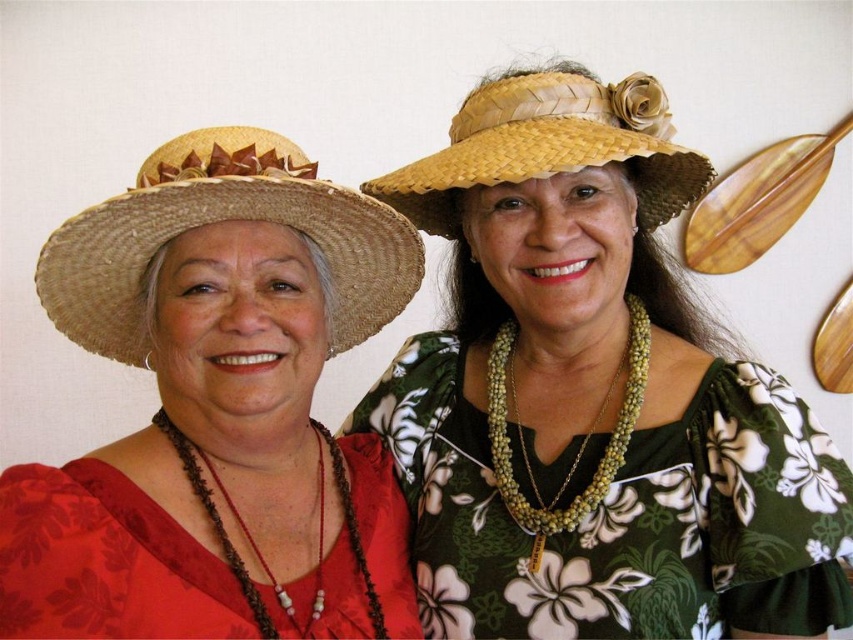
Does matte straw hat at upper center have a lesser height compared to woven straw hat at upper center?

No.

Can you confirm if matte straw hat at upper center is bigger than woven straw hat at upper center?

Indeed, matte straw hat at upper center has a larger size compared to woven straw hat at upper center.

This screenshot has width=853, height=640. Describe the element at coordinates (593, 396) in the screenshot. I see `matte straw hat at upper center` at that location.

Locate an element on the screen. The width and height of the screenshot is (853, 640). matte straw hat at upper center is located at coordinates [x=593, y=396].

Is matte red fabric dress at lower left above woven straw hat at upper center?

No.

How distant is matte red fabric dress at lower left from woven straw hat at upper center?

matte red fabric dress at lower left and woven straw hat at upper center are 15.62 inches apart from each other.

Does point (35, 621) come farther from viewer compared to point (454, 125)?

No.

At what (x,y) coordinates should I click in order to perform the action: click on matte red fabric dress at lower left. Please return your answer as a coordinate pair (x, y). Looking at the image, I should click on (105, 561).

Is matte straw hat at upper center below straw woven hat at left?

Correct, matte straw hat at upper center is located below straw woven hat at left.

In the scene shown: Is matte straw hat at upper center above straw woven hat at left?

No, matte straw hat at upper center is not above straw woven hat at left.

Which is in front, point (788, 604) or point (283, 211)?

Positioned in front is point (283, 211).

The height and width of the screenshot is (640, 853). Identify the location of matte straw hat at upper center. (593, 396).